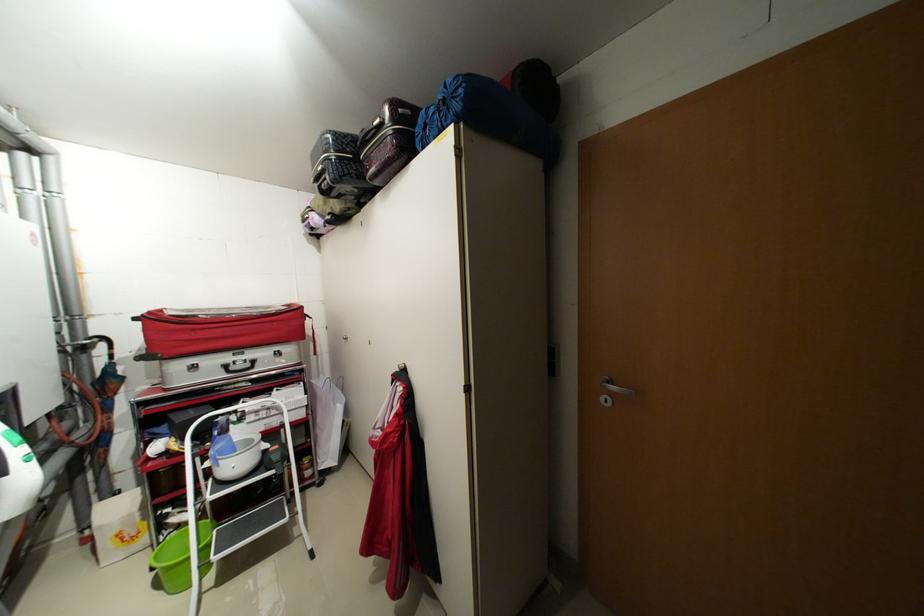
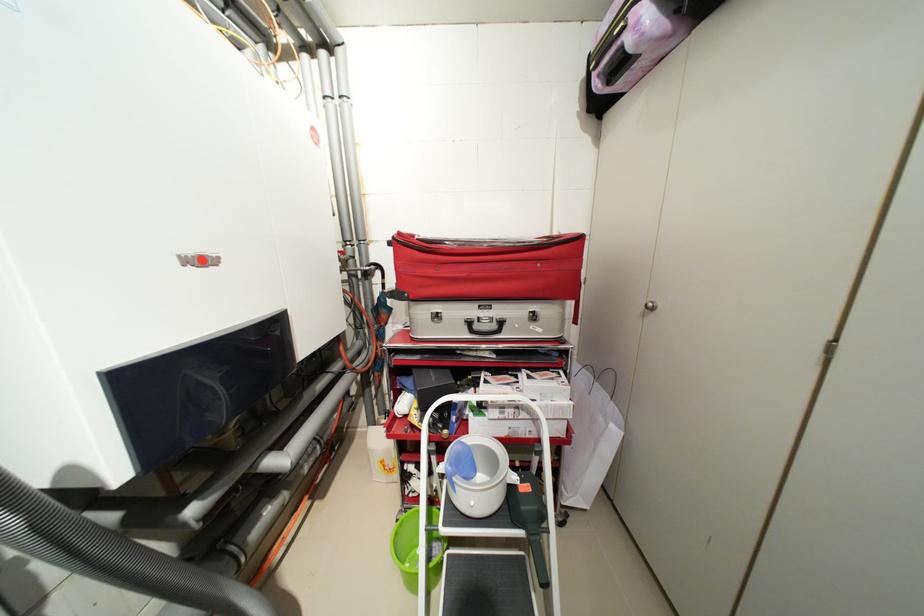
The point at (x=224, y=461) is marked in the first image. Where is the corresponding point in the second image?

(459, 485)